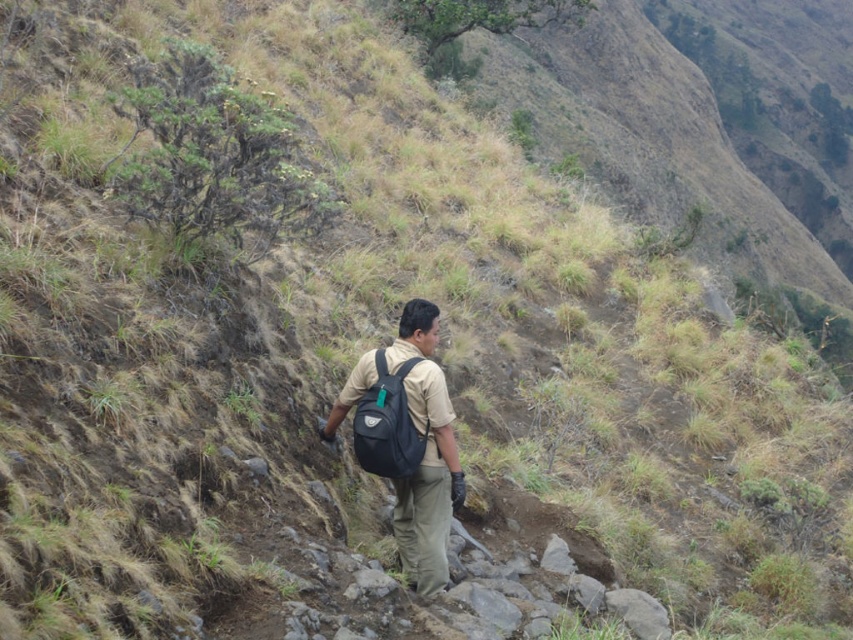
You are a hiker trying to decide which backpack to use for your next trip. You have two options in the image, the matte black backpack at center and the navy blue fabric backpack at center. Based on their sizes, which one can hold more items?

The matte black backpack at center has a greater width than the navy blue fabric backpack at center, so it can hold more items.